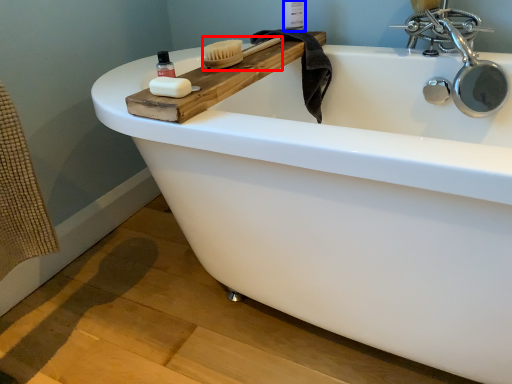
Question: Which of the following is the closest to the observer, brush (highlighted by a red box) or toiletry (highlighted by a blue box)?

Choices:
 (A) brush
 (B) toiletry

Answer: (A)